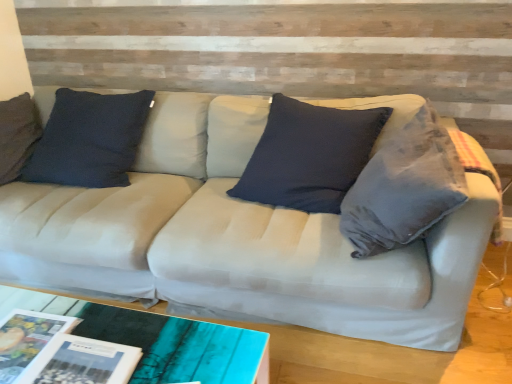
Question: Does matte paper magazine at lower left, the 1th magazine in the right-to-left sequence, have a lesser width compared to matte paper magazine at lower left, which is the 2th magazine in right-to-left order?

Choices:
 (A) yes
 (B) no

Answer: (B)

Question: Is matte paper magazine at lower left, the 1th magazine in the right-to-left sequence, far from matte paper magazine at lower left, the 1th magazine when ordered from left to right?

Choices:
 (A) no
 (B) yes

Answer: (A)

Question: From a real-world perspective, is matte paper magazine at lower left, the 1th magazine in the right-to-left sequence, on top of matte paper magazine at lower left, the 1th magazine when ordered from left to right?

Choices:
 (A) yes
 (B) no

Answer: (A)

Question: Considering the relative positions of matte paper magazine at lower left, which is counted as the second magazine, starting from the left, and matte paper magazine at lower left, the 1th magazine when ordered from left to right, in the image provided, is matte paper magazine at lower left, which is counted as the second magazine, starting from the left, to the left of matte paper magazine at lower left, the 1th magazine when ordered from left to right, from the viewer's perspective?

Choices:
 (A) yes
 (B) no

Answer: (B)

Question: Is matte paper magazine at lower left, the 1th magazine in the right-to-left sequence, wider than matte paper magazine at lower left, which is the 2th magazine in right-to-left order?

Choices:
 (A) no
 (B) yes

Answer: (B)

Question: From the image's perspective, would you say matte paper magazine at lower left, which is counted as the second magazine, starting from the left, is positioned over matte paper magazine at lower left, which is the 2th magazine in right-to-left order?

Choices:
 (A) no
 (B) yes

Answer: (A)

Question: Is matte paper magazine at lower left, the 1th magazine when ordered from left to right, thinner than matte paper magazine at lower left, which is counted as the second magazine, starting from the left?

Choices:
 (A) yes
 (B) no

Answer: (A)

Question: From a real-world perspective, is matte paper magazine at lower left, the 1th magazine when ordered from left to right, under matte paper magazine at lower left, the 1th magazine in the right-to-left sequence?

Choices:
 (A) yes
 (B) no

Answer: (A)

Question: Is matte paper magazine at lower left, which is the 2th magazine in right-to-left order, smaller than matte paper magazine at lower left, which is counted as the second magazine, starting from the left?

Choices:
 (A) no
 (B) yes

Answer: (B)

Question: From the image's perspective, is matte paper magazine at lower left, the 1th magazine when ordered from left to right, over matte paper magazine at lower left, the 1th magazine in the right-to-left sequence?

Choices:
 (A) yes
 (B) no

Answer: (A)

Question: Does matte paper magazine at lower left, which is the 2th magazine in right-to-left order, contain matte paper magazine at lower left, the 1th magazine in the right-to-left sequence?

Choices:
 (A) yes
 (B) no

Answer: (B)

Question: From the image's perspective, does matte paper magazine at lower left, the 1th magazine when ordered from left to right, appear lower than matte paper magazine at lower left, which is counted as the second magazine, starting from the left?

Choices:
 (A) yes
 (B) no

Answer: (B)

Question: Relative to matte paper magazine at lower left, the 1th magazine in the right-to-left sequence, is matte paper magazine at lower left, the 1th magazine when ordered from left to right, in front or behind?

Choices:
 (A) behind
 (B) front

Answer: (A)